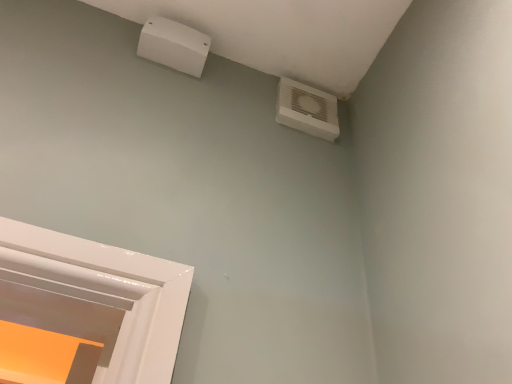
Question: Is white plastic outlet at upper center positioned in front of white plastic air conditioning unit at upper right?

Choices:
 (A) yes
 (B) no

Answer: (A)

Question: Does white plastic outlet at upper center lie behind white plastic air conditioning unit at upper right?

Choices:
 (A) yes
 (B) no

Answer: (B)

Question: Considering the relative sizes of white plastic outlet at upper center and white plastic air conditioning unit at upper right in the image provided, is white plastic outlet at upper center wider than white plastic air conditioning unit at upper right?

Choices:
 (A) no
 (B) yes

Answer: (B)

Question: Is there a large distance between white plastic outlet at upper center and white plastic air conditioning unit at upper right?

Choices:
 (A) yes
 (B) no

Answer: (B)

Question: Considering the relative positions of white plastic outlet at upper center and white plastic air conditioning unit at upper right in the image provided, is white plastic outlet at upper center to the right of white plastic air conditioning unit at upper right from the viewer's perspective?

Choices:
 (A) no
 (B) yes

Answer: (A)

Question: Considering the relative sizes of white plastic outlet at upper center and white plastic air conditioning unit at upper right in the image provided, is white plastic outlet at upper center shorter than white plastic air conditioning unit at upper right?

Choices:
 (A) yes
 (B) no

Answer: (A)

Question: Does white plastic air conditioning unit at upper right appear on the right side of white plastic outlet at upper center?

Choices:
 (A) yes
 (B) no

Answer: (A)

Question: Is white plastic air conditioning unit at upper right shorter than white plastic outlet at upper center?

Choices:
 (A) no
 (B) yes

Answer: (A)

Question: From a real-world perspective, is white plastic air conditioning unit at upper right over white plastic outlet at upper center?

Choices:
 (A) yes
 (B) no

Answer: (B)

Question: Is white plastic air conditioning unit at upper right at the left side of white plastic outlet at upper center?

Choices:
 (A) no
 (B) yes

Answer: (A)

Question: From the image's perspective, is white plastic air conditioning unit at upper right located above white plastic outlet at upper center?

Choices:
 (A) no
 (B) yes

Answer: (A)

Question: Is white plastic air conditioning unit at upper right not near white plastic outlet at upper center?

Choices:
 (A) no
 (B) yes

Answer: (A)

Question: From a real-world perspective, is white plastic air conditioning unit at upper right positioned above or below white plastic outlet at upper center?

Choices:
 (A) below
 (B) above

Answer: (A)